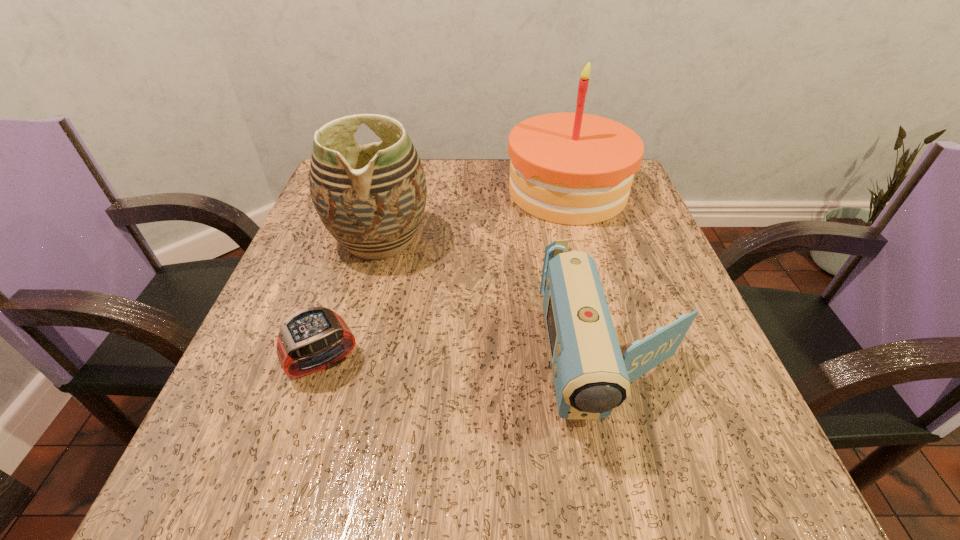
Identify the location of pottery that is at the left edge. (371, 198).

Where is `watch at the left edge`? watch at the left edge is located at coordinates (311, 332).

Where is `birthday cake that is positioned at the right edge`? The height and width of the screenshot is (540, 960). birthday cake that is positioned at the right edge is located at coordinates (568, 168).

At what (x,y) coordinates should I click in order to perform the action: click on camcorder situated at the right edge. Please return your answer as a coordinate pair (x, y). The width and height of the screenshot is (960, 540). Looking at the image, I should click on (591, 377).

Where is `object present at the far left corner`? object present at the far left corner is located at coordinates (371, 198).

This screenshot has height=540, width=960. Identify the location of object that is at the far right corner. (568, 168).

Find the location of `object that is at the near right corner`. object that is at the near right corner is located at coordinates (591, 377).

In the image, there is a desktop. Where is `free space at the far edge`? The image size is (960, 540). free space at the far edge is located at coordinates (501, 162).

The image size is (960, 540). Identify the location of free location at the near edge. (631, 457).

In the image, there is a desktop. Identify the location of vacant space at the left edge. (332, 380).